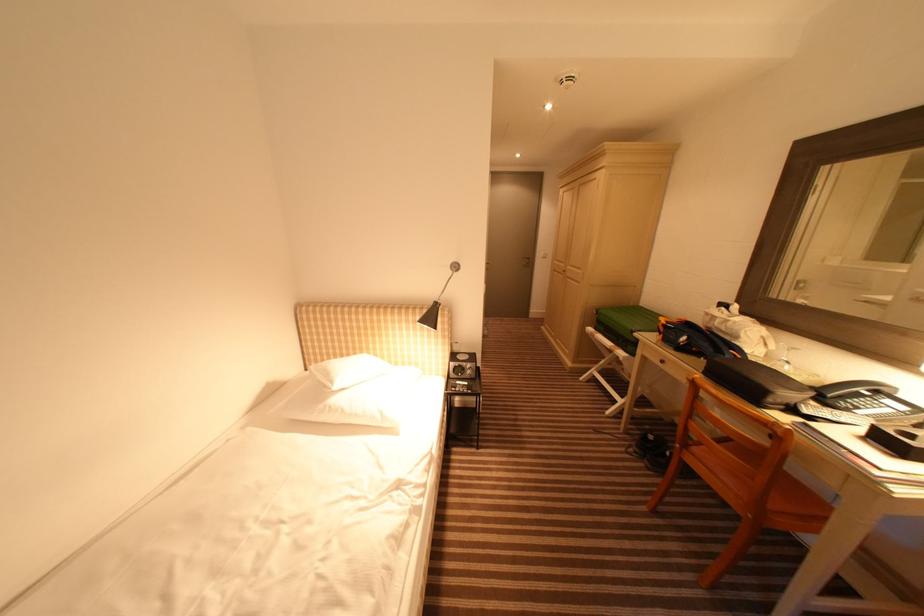
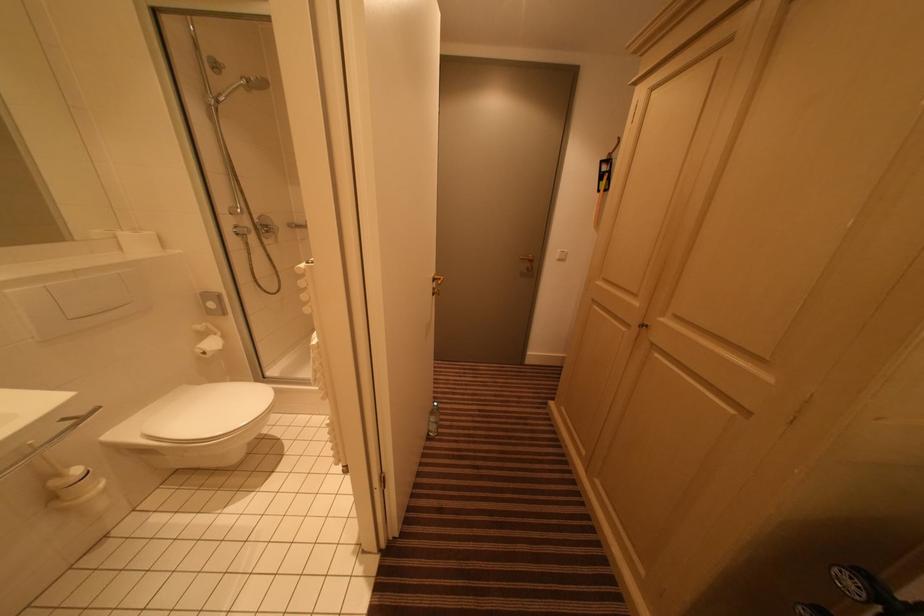
Question: What movement of the cameraman would produce the second image?

Choices:
 (A) Left
 (B) Right
 (C) Forward
 (D) Backward

Answer: (C)